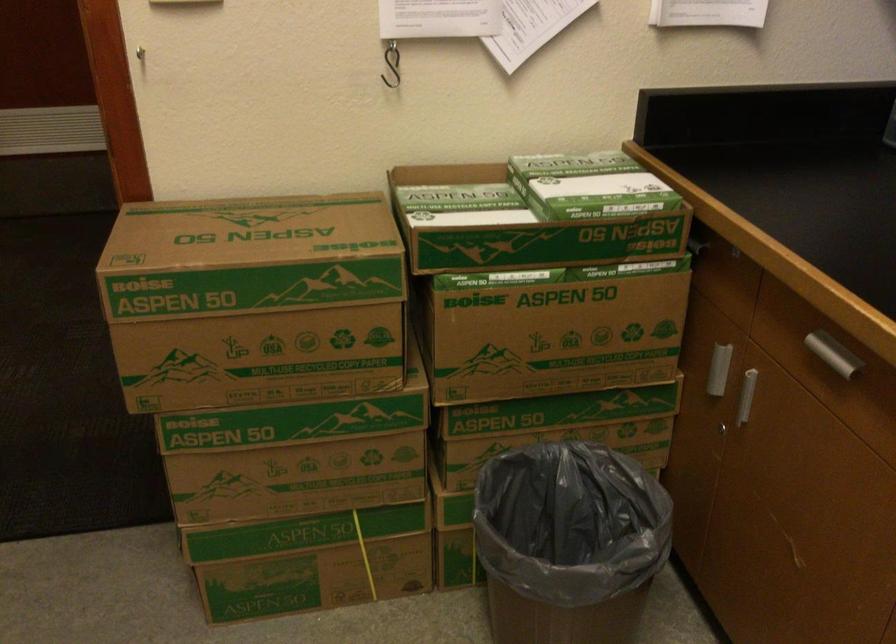
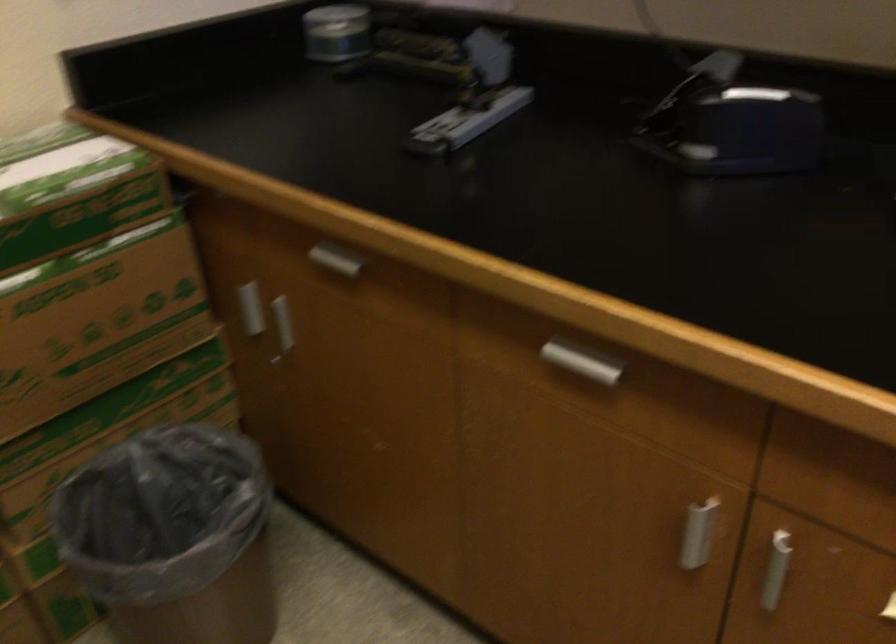
The point at [714,372] is marked in the first image. Where is the corresponding point in the second image?

(251, 308)